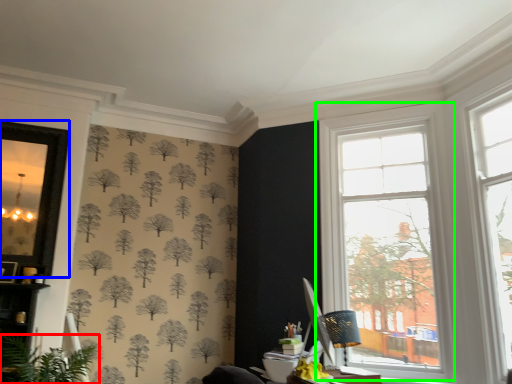
Question: Based on their relative distances, which object is farther from houseplant (highlighted by a red box)? Choose from window screen (highlighted by a blue box) and window (highlighted by a green box).

Choices:
 (A) window screen
 (B) window

Answer: (B)